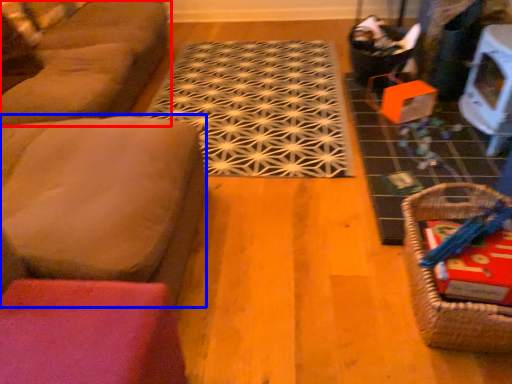
Question: Which of the following is the farthest to the observer, studio couch (highlighted by a red box) or couch (highlighted by a blue box)?

Choices:
 (A) studio couch
 (B) couch

Answer: (A)